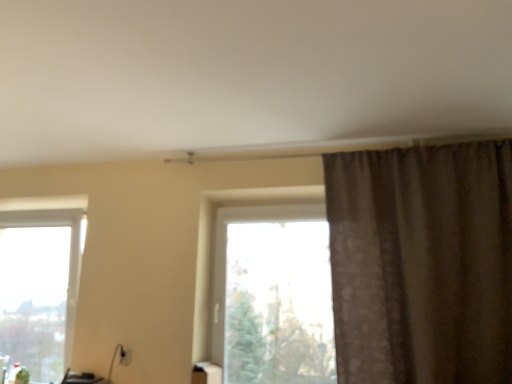
Question: Is transparent glass window at center, acting as the second window starting from the left, oriented away from clear glass window at lower left, the 1th window from the left?

Choices:
 (A) no
 (B) yes

Answer: (A)

Question: Does transparent glass window at center, acting as the second window starting from the left, have a greater height compared to clear glass window at lower left, the 2th window in the right-to-left sequence?

Choices:
 (A) yes
 (B) no

Answer: (B)

Question: Is transparent glass window at center, acting as the second window starting from the left, thinner than clear glass window at lower left, the 1th window from the left?

Choices:
 (A) yes
 (B) no

Answer: (B)

Question: Are transparent glass window at center, acting as the second window starting from the left, and clear glass window at lower left, the 2th window in the right-to-left sequence, located far from each other?

Choices:
 (A) yes
 (B) no

Answer: (A)

Question: Is transparent glass window at center, which appears as the first window when viewed from the right, aimed at clear glass window at lower left, the 2th window in the right-to-left sequence?

Choices:
 (A) yes
 (B) no

Answer: (B)

Question: Is transparent glass window at center, which appears as the first window when viewed from the right, outside clear glass window at lower left, the 1th window from the left?

Choices:
 (A) no
 (B) yes

Answer: (B)

Question: Is the surface of white glossy tissue box at lower center in direct contact with brown textured curtain at upper right?

Choices:
 (A) no
 (B) yes

Answer: (A)

Question: Does white glossy tissue box at lower center have a smaller size compared to brown textured curtain at upper right?

Choices:
 (A) yes
 (B) no

Answer: (A)

Question: From a real-world perspective, is white glossy tissue box at lower center under brown textured curtain at upper right?

Choices:
 (A) no
 (B) yes

Answer: (B)

Question: Can you confirm if white glossy tissue box at lower center is thinner than brown textured curtain at upper right?

Choices:
 (A) yes
 (B) no

Answer: (A)

Question: Are white glossy tissue box at lower center and brown textured curtain at upper right far apart?

Choices:
 (A) no
 (B) yes

Answer: (B)

Question: Considering the relative sizes of white glossy tissue box at lower center and brown textured curtain at upper right in the image provided, is white glossy tissue box at lower center bigger than brown textured curtain at upper right?

Choices:
 (A) no
 (B) yes

Answer: (A)

Question: Is white glossy tissue box at lower center to the left of clear glass window at lower left, the 2th window in the right-to-left sequence, from the viewer's perspective?

Choices:
 (A) no
 (B) yes

Answer: (A)